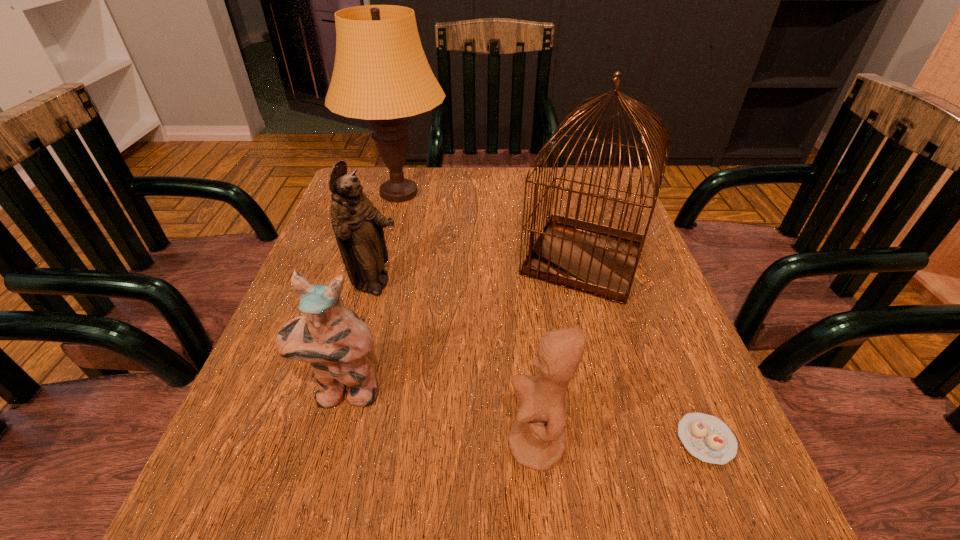
Point out which figurine is positioned as the second nearest to the rightmost figurine. Please provide its 2D coordinates. Your answer should be formatted as a tuple, i.e. [(x, y)], where the tuple contains the x and y coordinates of a point satisfying the conditions above.

[(358, 226)]

This screenshot has width=960, height=540. I want to click on the closest figurine to the lampshade, so click(x=358, y=226).